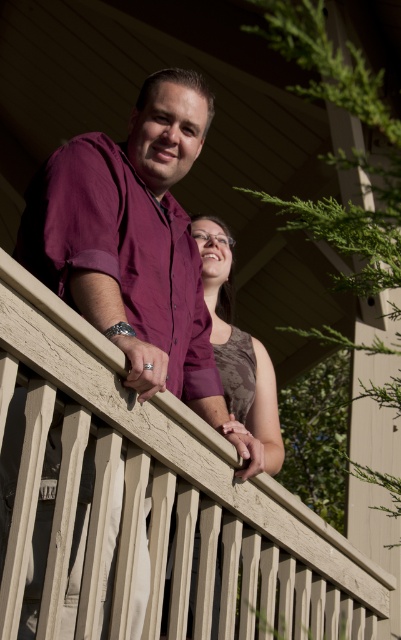
Based on the photo, which is below, matte purple shirt at upper left or brown textured dress at center?

Positioned lower is brown textured dress at center.

Can you confirm if matte purple shirt at upper left is shorter than brown textured dress at center?

No.

Looking at this image, measure the distance between point (157, 74) and camera.

A distance of 26.00 feet exists between point (157, 74) and camera.

Locate an element on the screen. matte purple shirt at upper left is located at coordinates (135, 246).

Does beige textured railing at upper center have a lesser height compared to brown textured dress at center?

No, beige textured railing at upper center is not shorter than brown textured dress at center.

Which is behind, point (364, 557) or point (216, 294)?

Positioned behind is point (216, 294).

Describe the element at coordinates (160, 500) in the screenshot. I see `beige textured railing at upper center` at that location.

Identify the location of beige textured railing at upper center. The width and height of the screenshot is (401, 640). (160, 500).

Who is more distant from viewer, (206, 625) or (184, 232)?

Point (184, 232)

Is beige textured railing at upper center below matte purple shirt at upper left?

Correct, beige textured railing at upper center is located below matte purple shirt at upper left.

Describe the element at coordinates (160, 500) in the screenshot. I see `beige textured railing at upper center` at that location.

At what (x,y) coordinates should I click in order to perform the action: click on beige textured railing at upper center. Please return your answer as a coordinate pair (x, y). Looking at the image, I should click on (160, 500).